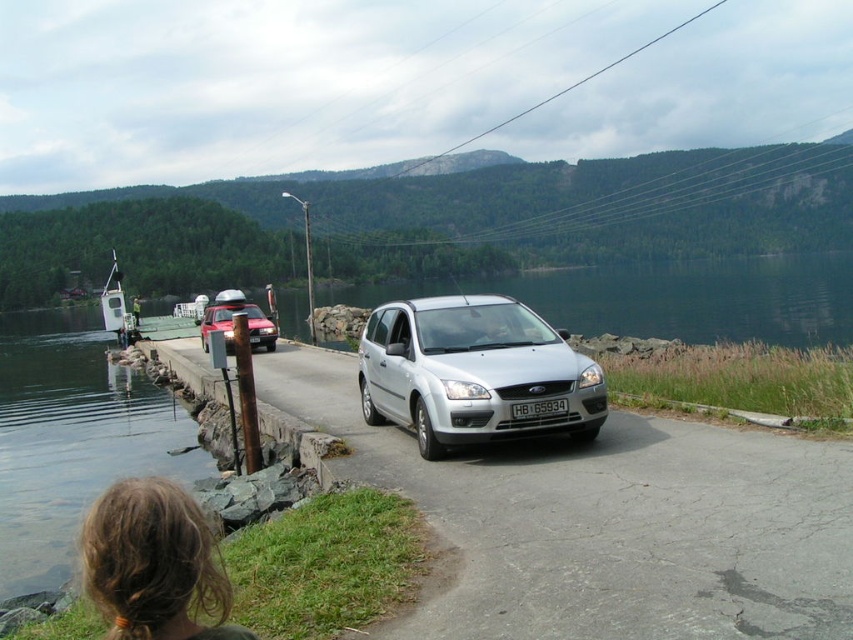
Between silver metallic hatchback at center and matte red car at left, which one is positioned lower?

Positioned lower is silver metallic hatchback at center.

Looking at this image, between silver metallic hatchback at center and matte red car at left, which one appears on the left side from the viewer's perspective?

matte red car at left

Which is behind, point (585, 396) or point (212, 320)?

The point (212, 320) is behind.

At what (x,y) coordinates should I click in order to perform the action: click on silver metallic hatchback at center. Please return your answer as a coordinate pair (x, y). Looking at the image, I should click on (474, 372).

Consider the image. Can you confirm if clear water at dock left is smaller than silver metallic hatchback at center?

Actually, clear water at dock left might be larger than silver metallic hatchback at center.

Is point (163, 442) closer to viewer compared to point (508, 340)?

No, it is behind (508, 340).

Find the location of `clear water at dock left`. clear water at dock left is located at coordinates (73, 438).

Identify the location of clear water at dock left. Image resolution: width=853 pixels, height=640 pixels. (73, 438).

Between clear water at dock left and brown hair at lower left, which one appears on the left side from the viewer's perspective?

clear water at dock left

The height and width of the screenshot is (640, 853). What do you see at coordinates (73, 438) in the screenshot? I see `clear water at dock left` at bounding box center [73, 438].

This screenshot has width=853, height=640. In order to click on clear water at dock left in this screenshot , I will do `click(73, 438)`.